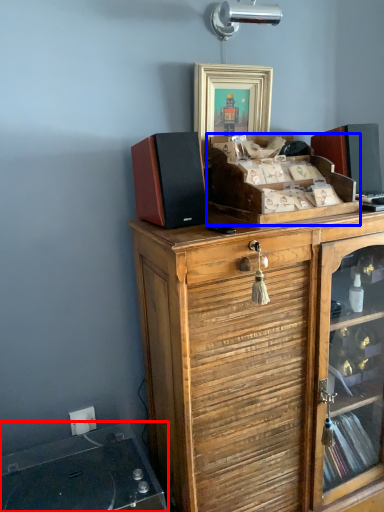
Question: Which object is closer to the camera taking this photo, wide (highlighted by a red box) or cabinetry (highlighted by a blue box)?

Choices:
 (A) wide
 (B) cabinetry

Answer: (A)